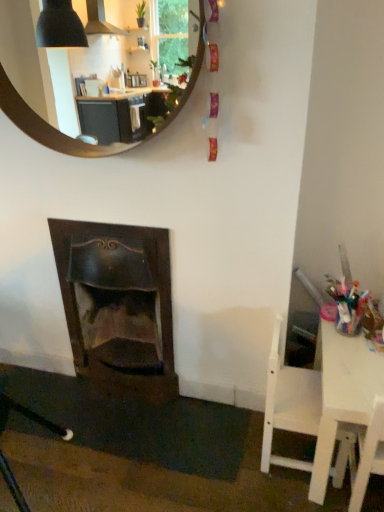
Question: Is white wood chair at lower right completely or partially inside dark wood fireplace at lower left?

Choices:
 (A) yes
 (B) no

Answer: (B)

Question: Considering the relative sizes of dark wood fireplace at lower left and white wood chair at lower right in the image provided, is dark wood fireplace at lower left bigger than white wood chair at lower right?

Choices:
 (A) yes
 (B) no

Answer: (A)

Question: Is dark wood fireplace at lower left positioned in front of white wood chair at lower right?

Choices:
 (A) no
 (B) yes

Answer: (A)

Question: Considering the relative sizes of dark wood fireplace at lower left and white wood chair at lower right in the image provided, is dark wood fireplace at lower left taller than white wood chair at lower right?

Choices:
 (A) yes
 (B) no

Answer: (A)

Question: Can you confirm if dark wood fireplace at lower left is wider than white wood chair at lower right?

Choices:
 (A) no
 (B) yes

Answer: (A)

Question: Is dark wood fireplace at lower left looking in the opposite direction of white wood chair at lower right?

Choices:
 (A) yes
 (B) no

Answer: (B)

Question: Does white plastic table at right have a lesser width compared to wooden round mirror at upper center?

Choices:
 (A) yes
 (B) no

Answer: (B)

Question: Is white plastic table at right taller than wooden round mirror at upper center?

Choices:
 (A) yes
 (B) no

Answer: (B)

Question: Is white plastic table at right with wooden round mirror at upper center?

Choices:
 (A) yes
 (B) no

Answer: (B)

Question: From the image's perspective, is white plastic table at right on top of wooden round mirror at upper center?

Choices:
 (A) yes
 (B) no

Answer: (B)

Question: Does white plastic table at right have a greater width compared to wooden round mirror at upper center?

Choices:
 (A) yes
 (B) no

Answer: (A)

Question: Does white plastic table at right appear on the right side of wooden round mirror at upper center?

Choices:
 (A) yes
 (B) no

Answer: (A)

Question: Is there a large distance between wooden round mirror at upper center and dark wood fireplace at lower left?

Choices:
 (A) yes
 (B) no

Answer: (B)